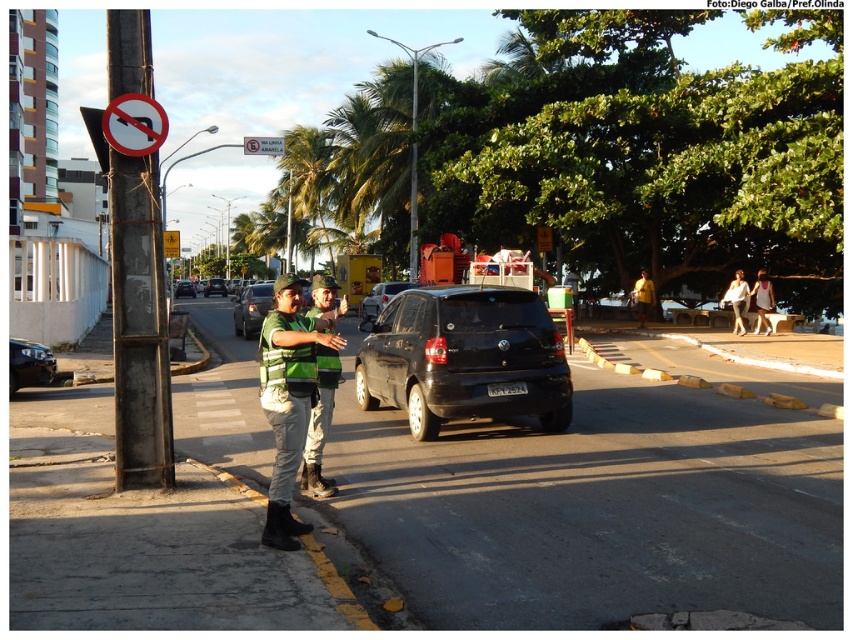
You are a pedestrian standing at the point labeled as point (x=463, y=358) in the image. You want to cross the street to reach the sidewalk on the opposite side. Is there a safe path to cross here?

The point (x=463, y=358) indicates a black matte SUV at center. Since the SUV is blocking the path, it might not be safe to cross here. Look for another spot where there is no vehicle obstructing the way.

You are a parking attendant and need to fit both the black matte suv at center and the shiny black sedan at lower left into a parking spot that is 5 meters wide. Can both vehicles fit side by side in the spot?

The black matte suv at center is wider than the shiny black sedan at lower left. If the combined width of both vehicles is less than or equal to 5 meters, they can fit side by side. However, since the SUV is wider, it depends on their exact dimensions. Without specific measurements, it is uncertain if they will both fit.